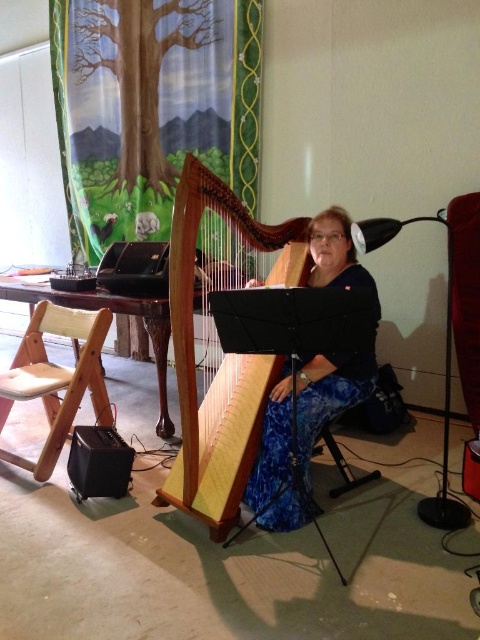
You are a photographer setting up for a portrait. You want to ensure the wooden harp at center and the blue floral pants at center are both clearly visible. Which object should you focus on first to avoid blurring either of them?

The wooden harp at center is positioned over blue floral pants at center, so focusing on the wooden harp at center first will ensure both are in focus since it is closer to the camera.

You are designing a new seating arrangement for a small music studio. You have the blue floral pants at center and the light wood folding chair at left. Which object is narrower and should be placed in a tighter space?

The blue floral pants at center has a lesser width compared to the light wood folding chair at left, so it should be placed in the tighter space.

You are standing in the room where the person is playing the harp. You want to place a small stool exactly at the point marked by coordinates point (218,346). Where should you place the stool?

The point (218,346) corresponds to the wooden harp at center, so you should place the stool at the wooden harp at center.